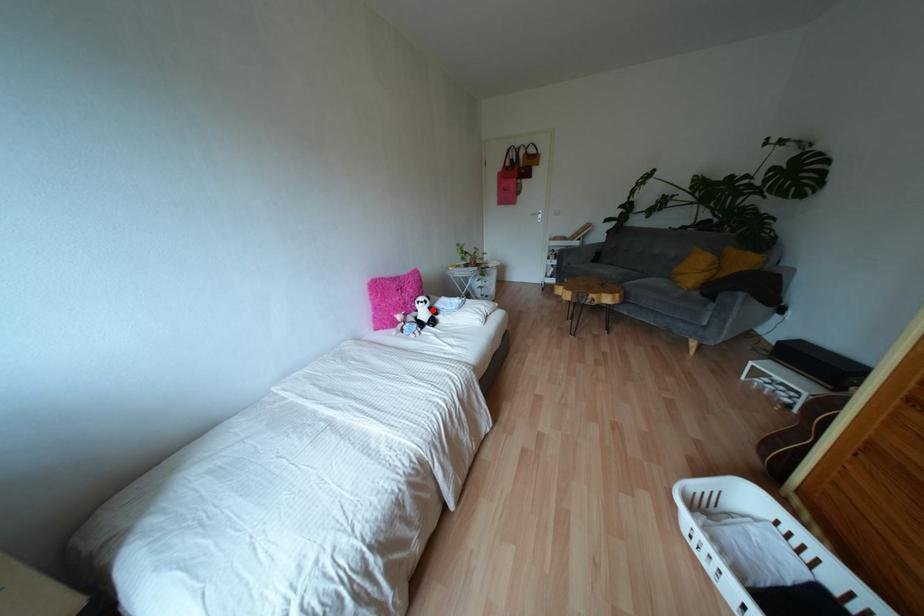
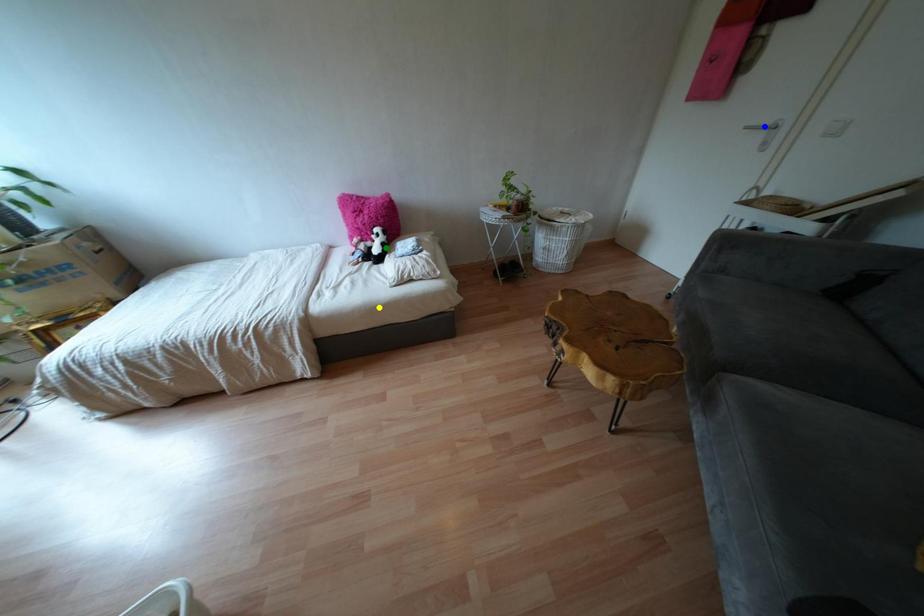
Question: I am providing you with two images of the same scene from different viewpoints. A red point is marked on the first image. You are given multiple points on the second image. Which mark in image 2 goes with the point in image 1?

Choices:
 (A) blue point
 (B) green point
 (C) yellow point

Answer: (B)